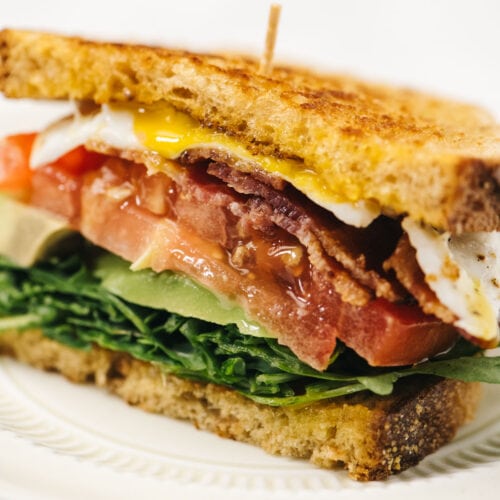
The height and width of the screenshot is (500, 500). I want to click on white plate, so click(x=107, y=483).